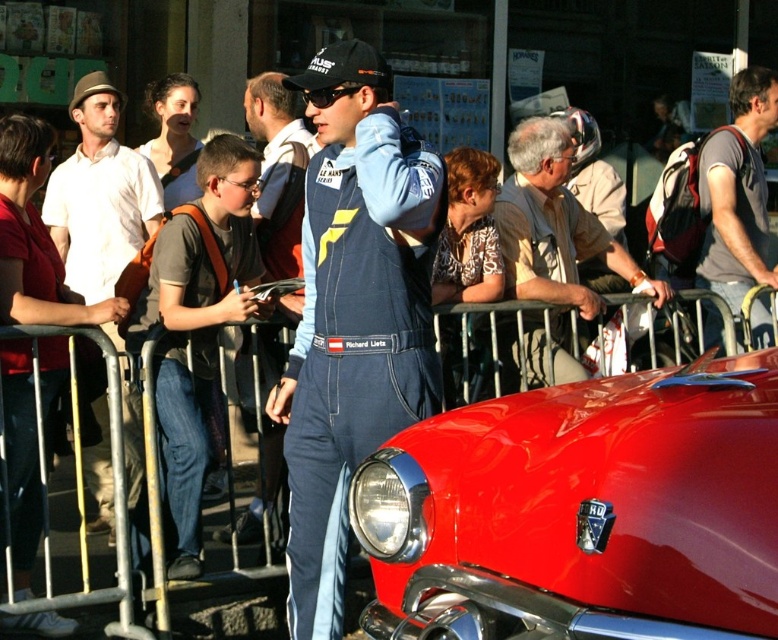
You are standing at the origin point of the coordinate system. You want to walk to the shiny red car at center. What direction should you head towards?

The shiny red car at center is located at coordinate point (582, 509), so you should head towards the direction of positive x and y axes from the origin point.

You are a photographer at the event and want to capture a photo of the shiny red car at center without including the blue denim jumpsuit at center in the shot. How should you adjust your camera angle?

Since the shiny red car at center is located below the blue denim jumpsuit at center, you can lower your camera angle to focus on the car while positioning the jumpsuit out of the frame.

You are standing at the center of the image and want to locate the matte white shirt at left. Which direction should you turn to face it?

To face the matte white shirt at left, you should turn to your left since it is located at the left side of the image.